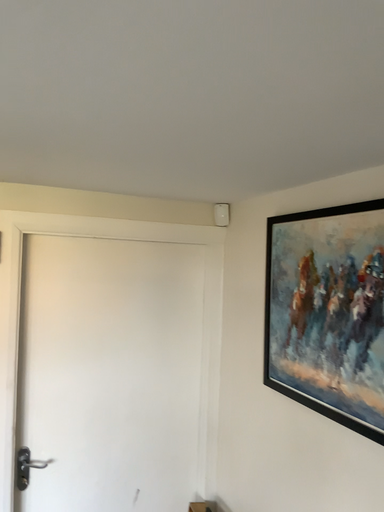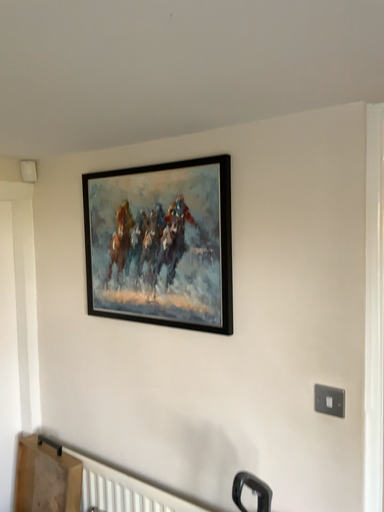
Question: Which way did the camera rotate in the video?

Choices:
 (A) rotated left
 (B) rotated right

Answer: (B)